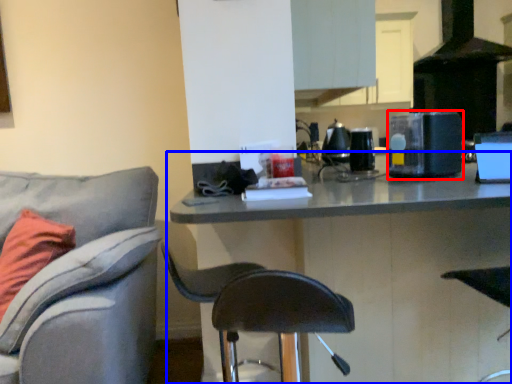
Question: Which object appears closest to the camera in this image, appliance (highlighted by a red box) or table (highlighted by a blue box)?

Choices:
 (A) appliance
 (B) table

Answer: (B)